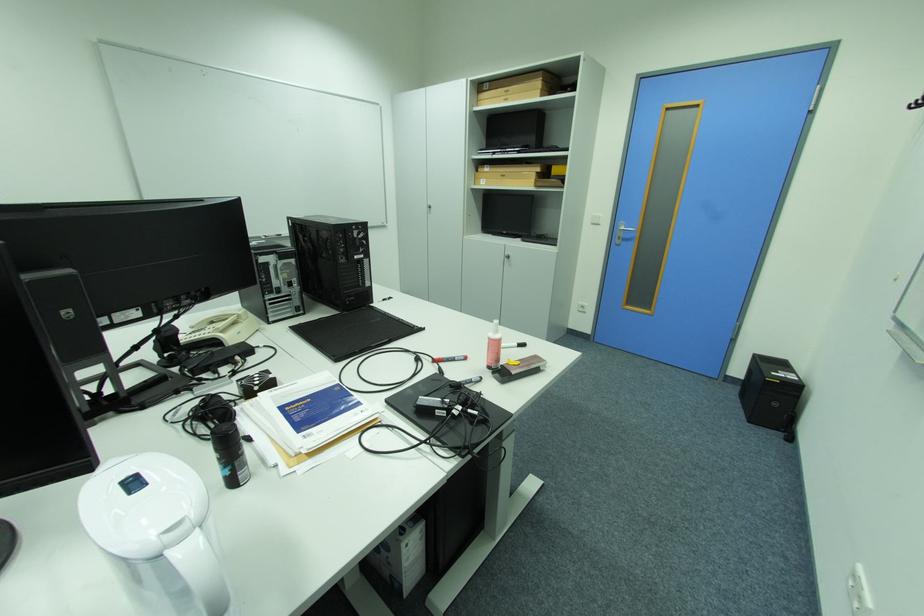
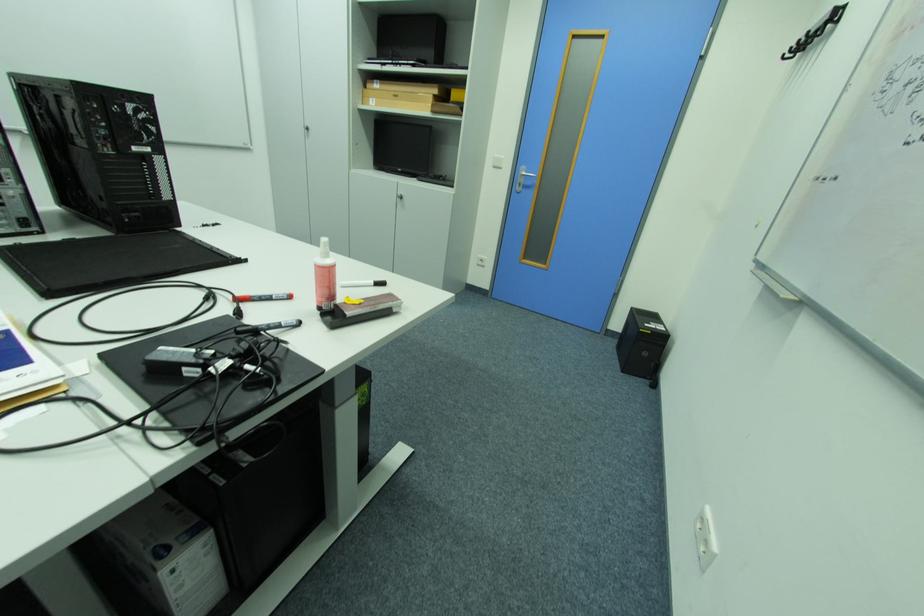
Question: How did the camera likely rotate?

Choices:
 (A) Left
 (B) Right
 (C) Up
 (D) Down

Answer: (B)